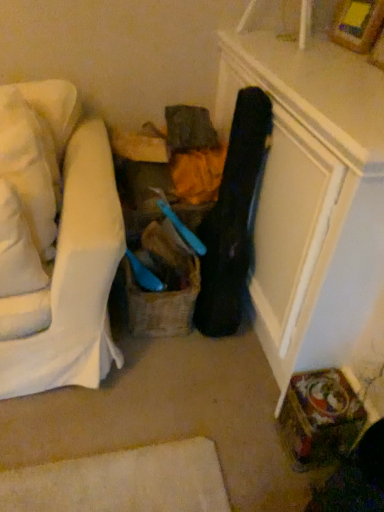
Question: From the image's perspective, is white fabric pillow at left, arranged as the first pillow when viewed from the front, above burlap basket at center?

Choices:
 (A) yes
 (B) no

Answer: (A)

Question: Can you confirm if white fabric pillow at left, arranged as the first pillow when viewed from the front, is wider than burlap basket at center?

Choices:
 (A) yes
 (B) no

Answer: (B)

Question: From a real-world perspective, is white fabric pillow at left, which ranks as the second pillow in back-to-front order, under burlap basket at center?

Choices:
 (A) no
 (B) yes

Answer: (A)

Question: Is white fabric pillow at left, which ranks as the second pillow in back-to-front order, further to camera compared to burlap basket at center?

Choices:
 (A) yes
 (B) no

Answer: (B)

Question: Considering the relative positions of white fabric pillow at left, arranged as the first pillow when viewed from the front, and burlap basket at center in the image provided, is white fabric pillow at left, arranged as the first pillow when viewed from the front, in front of burlap basket at center?

Choices:
 (A) yes
 (B) no

Answer: (A)

Question: From a real-world perspective, is wooden picture frame at upper right above or below black leather guitar case at center?

Choices:
 (A) below
 (B) above

Answer: (B)

Question: In terms of size, does wooden picture frame at upper right appear bigger or smaller than black leather guitar case at center?

Choices:
 (A) big
 (B) small

Answer: (B)

Question: Looking at their shapes, would you say wooden picture frame at upper right is wider or thinner than black leather guitar case at center?

Choices:
 (A) thin
 (B) wide

Answer: (A)

Question: Based on their positions, is wooden picture frame at upper right located to the left or right of black leather guitar case at center?

Choices:
 (A) left
 (B) right

Answer: (B)

Question: Considering the positions of white soft pillow at left, placed as the 2th pillow when sorted from front to back, and burlap basket at center in the image, is white soft pillow at left, placed as the 2th pillow when sorted from front to back, taller or shorter than burlap basket at center?

Choices:
 (A) short
 (B) tall

Answer: (B)

Question: From a real-world perspective, relative to burlap basket at center, is white soft pillow at left, which is the 1th pillow from back to front, vertically above or below?

Choices:
 (A) above
 (B) below

Answer: (A)

Question: Would you say white soft pillow at left, placed as the 2th pillow when sorted from front to back, is to the left or to the right of burlap basket at center in the picture?

Choices:
 (A) left
 (B) right

Answer: (A)

Question: Is point (31, 115) closer or farther from the camera than point (130, 306)?

Choices:
 (A) closer
 (B) farther

Answer: (A)

Question: From a real-world perspective, is black leather guitar case at center physically located above or below white fabric pillow at left, arranged as the first pillow when viewed from the front?

Choices:
 (A) below
 (B) above

Answer: (A)

Question: Considering the positions of point (216, 327) and point (19, 276), is point (216, 327) closer or farther from the camera than point (19, 276)?

Choices:
 (A) farther
 (B) closer

Answer: (A)